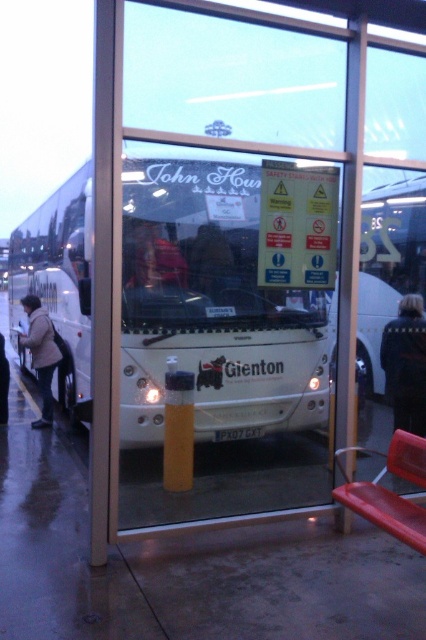
Who is higher up, white matte bus at center or dark fabric jacket at right?

Positioned higher is dark fabric jacket at right.

Which is in front, point (267, 385) or point (382, 337)?

Point (267, 385)

Identify the location of white matte bus at center. This screenshot has width=426, height=640. (215, 308).

Does point (414, 429) lie behind point (43, 358)?

No, it is not.

Can you confirm if dark fabric jacket at right is positioned above light brown leather jacket at left?

Correct, dark fabric jacket at right is located above light brown leather jacket at left.

Where is `dark fabric jacket at right`? The image size is (426, 640). dark fabric jacket at right is located at coordinates (405, 364).

This screenshot has height=640, width=426. What are the coordinates of `dark fabric jacket at right` in the screenshot? It's located at (405, 364).

From the picture: Is white matte bus at center closer to the viewer compared to matte red jacket at center?

No, it is behind matte red jacket at center.

Does white matte bus at center have a greater height compared to matte red jacket at center?

Yes, white matte bus at center is taller than matte red jacket at center.

Is point (196, 260) positioned behind point (172, 282)?

Yes.

You are a GUI agent. You are given a task and a screenshot of the screen. Output one action in this format:
    pyautogui.click(x=<x>, y=<y>)
    Task: Click on the white matte bus at center
    This screenshot has height=640, width=426.
    Given the screenshot: What is the action you would take?
    pyautogui.click(x=215, y=308)